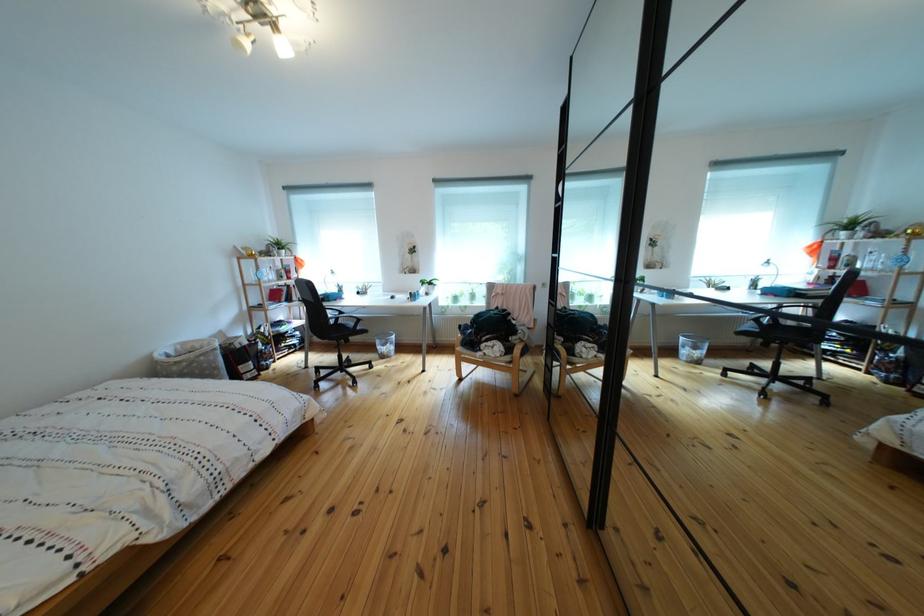
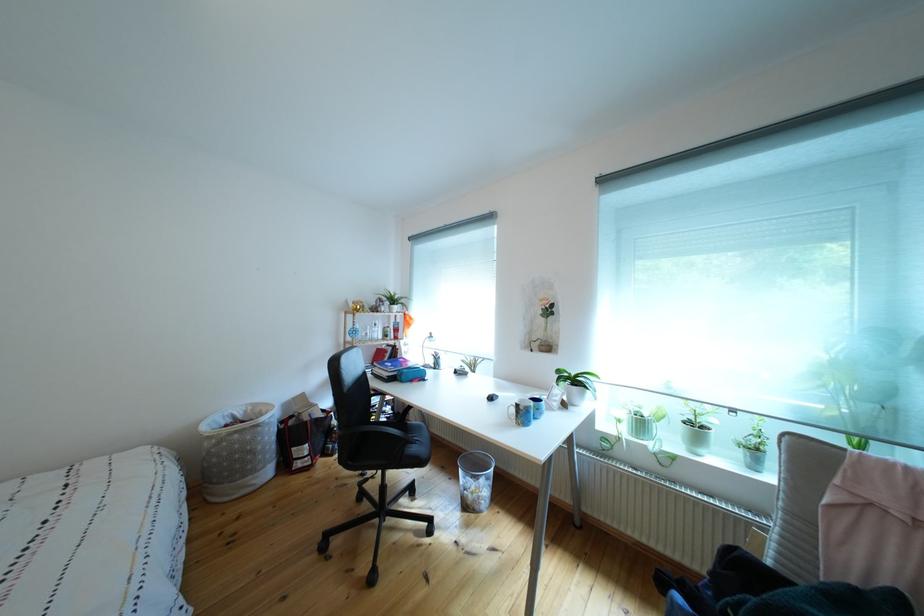
Locate, in the second image, the point that corresponds to [442,290] in the first image.

(588, 387)